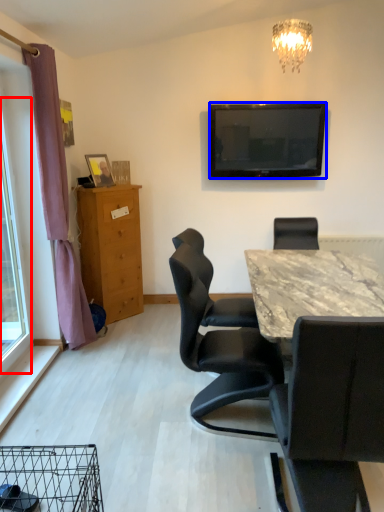
Question: Which of the following is the closest to the observer, glass door (highlighted by a red box) or television (highlighted by a blue box)?

Choices:
 (A) glass door
 (B) television

Answer: (A)